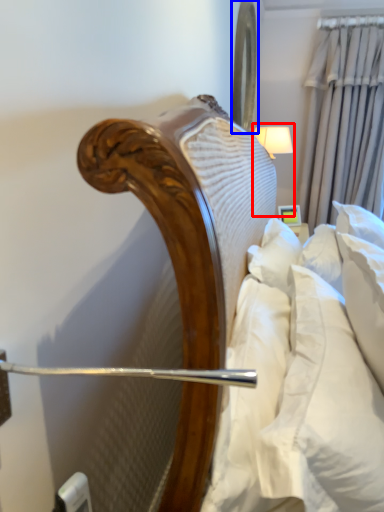
Question: Which object is further to the camera taking this photo, bedside lamp (highlighted by a red box) or mirror (highlighted by a blue box)?

Choices:
 (A) bedside lamp
 (B) mirror

Answer: (A)